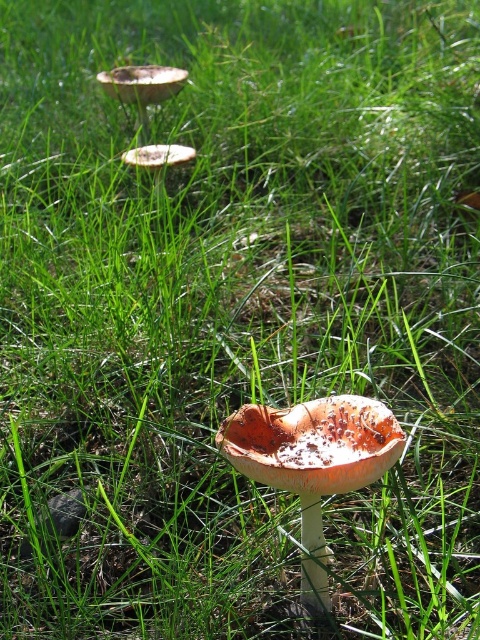
Based on the photo, does orange matte mushroom at center have a greater height compared to orange-brown cap at upper center?

Incorrect, orange matte mushroom at center's height is not larger of orange-brown cap at upper center's.

Is the position of orange matte mushroom at center less distant than that of orange-brown cap at upper center?

That is True.

Identify the location of orange matte mushroom at center. (313, 461).

Locate an element on the screen. orange matte mushroom at center is located at coordinates (313, 461).

Measure the distance between orange-brown cap at upper center and camera.

orange-brown cap at upper center and camera are 9.01 feet apart.

Does orange-brown cap at upper center have a greater height compared to white matte mushroom at upper left?

Yes.

Is point (156, 96) positioned before point (181, 157)?

That is False.

At what (x,y) coordinates should I click in order to perform the action: click on orange-brown cap at upper center. Please return your answer as a coordinate pair (x, y). Looking at the image, I should click on (143, 86).

Who is lower down, orange matte mushroom at center or white matte mushroom at upper left?

Positioned lower is orange matte mushroom at center.

Between point (273, 461) and point (170, 148), which one is positioned in front?

Point (273, 461) is more forward.

Find the location of a particular element. The height and width of the screenshot is (640, 480). orange matte mushroom at center is located at coordinates (313, 461).